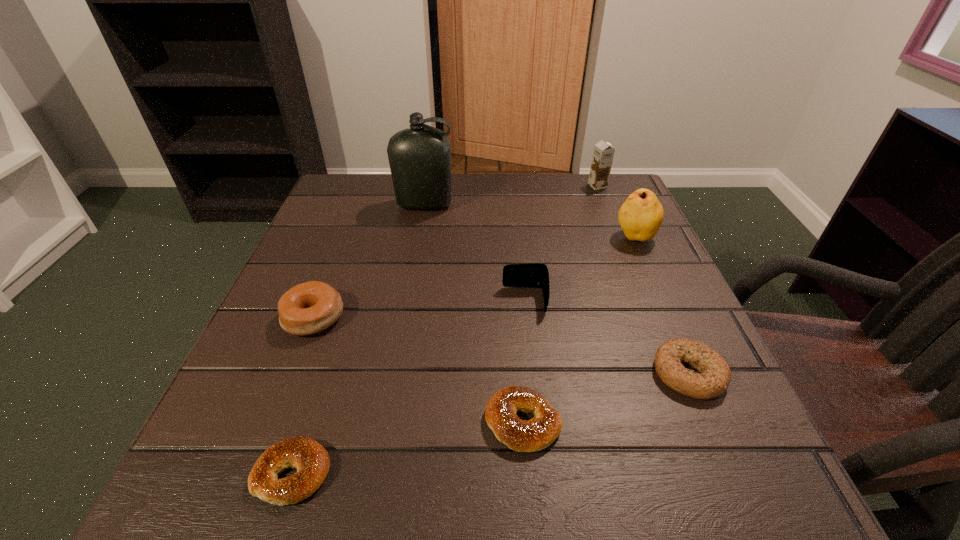
Locate which bagel ranks fourth in proximity to the chocolate milk. Please provide its 2D coordinates. Your answer should be formatted as a tuple, i.e. [(x, y)], where the tuple contains the x and y coordinates of a point satisfying the conditions above.

[(311, 460)]

The image size is (960, 540). What are the coordinates of `the closest bagel relative to the wallet` in the screenshot? It's located at (533, 435).

Locate an element on the screen. vacant area that satisfies the following two spatial constraints: 1. on the back side of the farthest bagel; 2. on the left side of the pear is located at coordinates (346, 237).

Where is `vacant area that satisfies the following two spatial constraints: 1. on the back side of the third bagel from left to right; 2. on the right side of the rightmost bagel`? This screenshot has width=960, height=540. vacant area that satisfies the following two spatial constraints: 1. on the back side of the third bagel from left to right; 2. on the right side of the rightmost bagel is located at coordinates (519, 373).

Identify the location of free spot that satisfies the following two spatial constraints: 1. on the front side of the rightmost bagel; 2. on the left side of the farthest object. (673, 373).